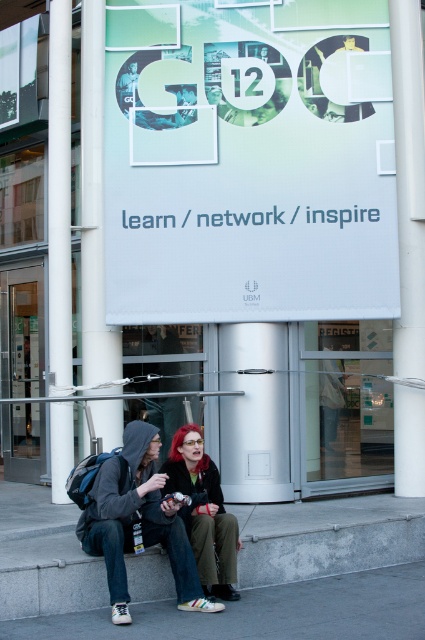
Is matte black hoodie at lower left wider than shiny red hair at center?

Indeed, matte black hoodie at lower left has a greater width compared to shiny red hair at center.

How far apart are matte black hoodie at lower left and shiny red hair at center?

A distance of 12.53 inches exists between matte black hoodie at lower left and shiny red hair at center.

Is point (91, 544) farther from viewer compared to point (223, 532)?

That is False.

The width and height of the screenshot is (425, 640). What are the coordinates of `matte black hoodie at lower left` in the screenshot? It's located at (138, 522).

Can you confirm if gray concrete stairs at lower center is shorter than matte black hoodie at lower left?

Correct, gray concrete stairs at lower center is not as tall as matte black hoodie at lower left.

Does gray concrete stairs at lower center appear on the left side of matte black hoodie at lower left?

In fact, gray concrete stairs at lower center is to the right of matte black hoodie at lower left.

Image resolution: width=425 pixels, height=640 pixels. In order to click on gray concrete stairs at lower center in this screenshot , I will do `click(326, 538)`.

Does matte black hoodie at lower left lie behind white smooth pillar at left?

No, it is in front of white smooth pillar at left.

Can you confirm if matte black hoodie at lower left is thinner than white smooth pillar at left?

No, matte black hoodie at lower left is not thinner than white smooth pillar at left.

Is point (144, 516) in front of point (53, 186)?

Yes, point (144, 516) is in front of point (53, 186).

Where is `matte black hoodie at lower left`? Image resolution: width=425 pixels, height=640 pixels. matte black hoodie at lower left is located at coordinates (138, 522).